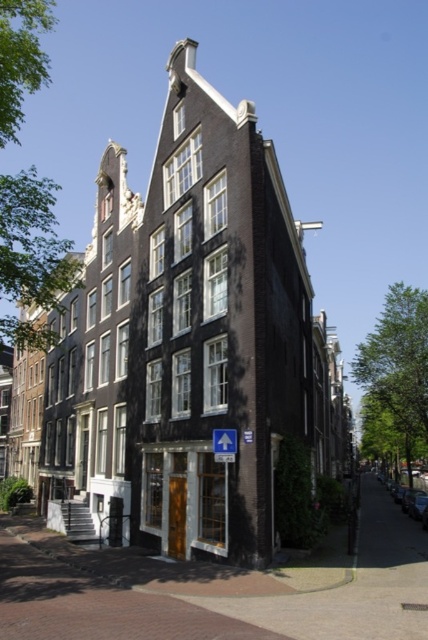
You are a delivery driver who needs to park your vehicle next to the shiny silver sedan at right without blocking the blue plastic arrow at upper center. Can you fit your vehicle there?

The shiny silver sedan at right is larger than the blue plastic arrow at upper center. Since the blue plastic arrow at upper center is smaller, there might be enough space to park next to the shiny silver sedan at right without blocking it, but the exact feasibility depends on the available space not described here.

You are standing at the point closest to the entrance of the Dutch building. There are two points marked on the ground in front of you, labeled as point (425, 500) and point (222, 461). Which point is farther away from you?

Point (425, 500) is behind point (222, 461), so the point farther away from you is point (425, 500).

You are a delivery driver who needs to park your shiny silver sedan at right in a parking spot that can only accommodate vehicles narrower than the blue plastic arrow at upper center. Can your vehicle fit?

The shiny silver sedan at right has a width larger than the blue plastic arrow at upper center, so it cannot fit into the parking spot.